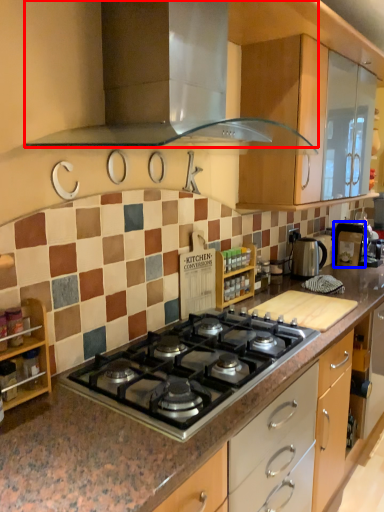
Question: Which of the following is the closest to the observer, home appliance (highlighted by a red box) or appliance (highlighted by a blue box)?

Choices:
 (A) home appliance
 (B) appliance

Answer: (A)